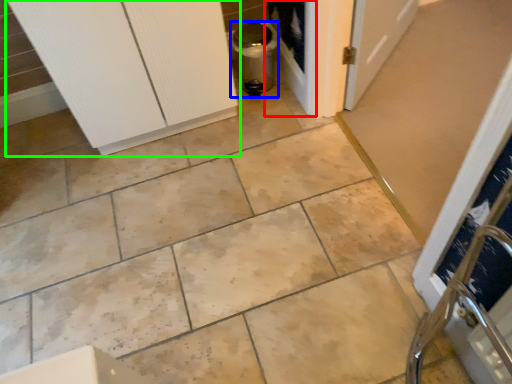
Question: Based on their relative distances, which object is nearer to screen door (highlighted by a red box)? Choose from appliance (highlighted by a blue box) and door (highlighted by a green box).

Choices:
 (A) appliance
 (B) door

Answer: (A)